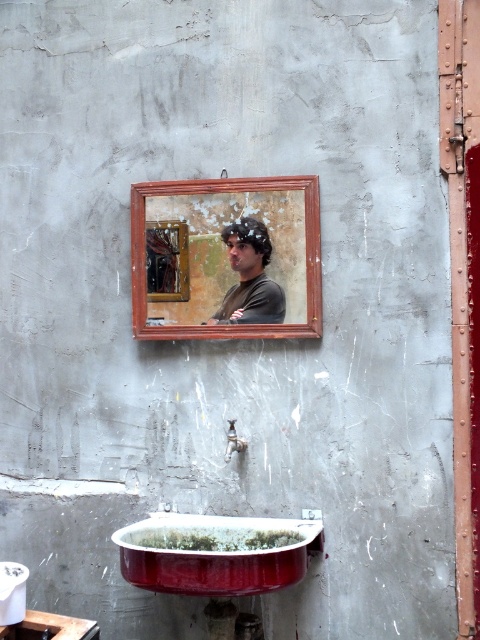
Who is positioned more to the left, wooden frame at upper center or matte black shirt at center?

wooden frame at upper center is more to the left.

Find the location of a particular element. wooden frame at upper center is located at coordinates (226, 259).

In the scene shown: Is red enameled sink at lower center in front of matte silver faucet at lower center?

That is True.

Which is more to the right, red enameled sink at lower center or matte silver faucet at lower center?

matte silver faucet at lower center is more to the right.

The image size is (480, 640). What are the coordinates of `red enameled sink at lower center` in the screenshot? It's located at (216, 554).

Between wooden frame at upper center and red enameled sink at lower center, which one has less height?

With less height is red enameled sink at lower center.

Is wooden frame at upper center to the left of red enameled sink at lower center from the viewer's perspective?

No, wooden frame at upper center is not to the left of red enameled sink at lower center.

Does point (216, 310) come closer to viewer compared to point (188, 534)?

No, (216, 310) is further to viewer.

In order to click on wooden frame at upper center in this screenshot , I will do `click(226, 259)`.